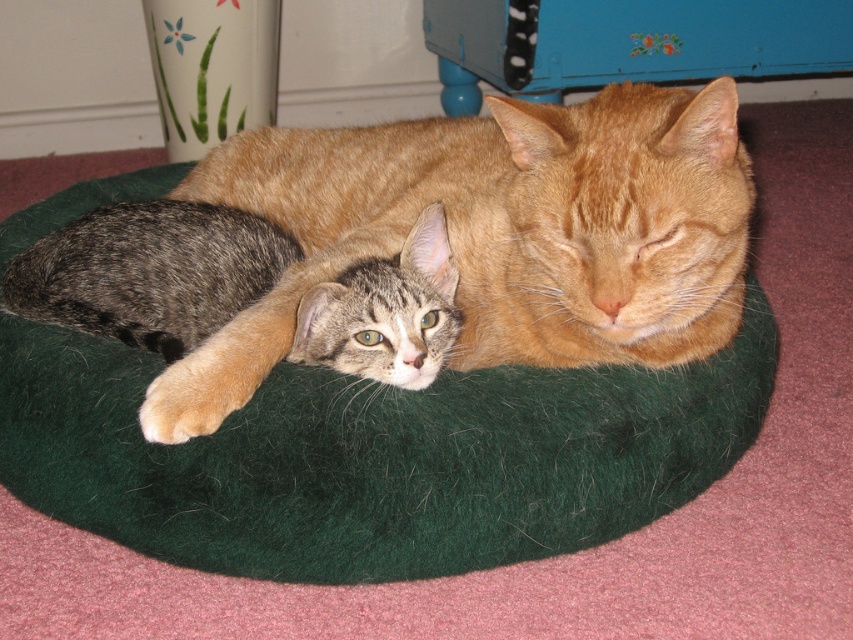
You are a pet owner who wants to place a new toy on the green felt cat bed at center without disturbing the gray tabby kitten at center. Based on their positions, where should you place the toy?

The green felt cat bed at center is below the gray tabby kitten at center, so you should place the toy on the bed but away from where the kitten is resting to avoid disturbing it.

You are a cat owner who wants to place a small toy on the green felt cat bed at center so that the gray tabby kitten at center can reach it easily. Based on their heights, will the toy be accessible for the kitten?

The green felt cat bed at center has a greater height compared to gray tabby kitten at center. Since the bed is taller than the kitten, placing the toy on the bed might make it difficult for the kitten to reach the toy easily.

You are a cat owner who wants to place a new toy on the floor near the green felt cat bed at center and the gray tabby kitten at center. Since the bed is larger than the kitten, where should you place the toy so that it is closer to the smaller animal?

The gray tabby kitten at center is smaller than the green felt cat bed at center. Therefore, to place the toy closer to the smaller animal, you should put it near the gray tabby kitten at center since it is the smaller one between the two.